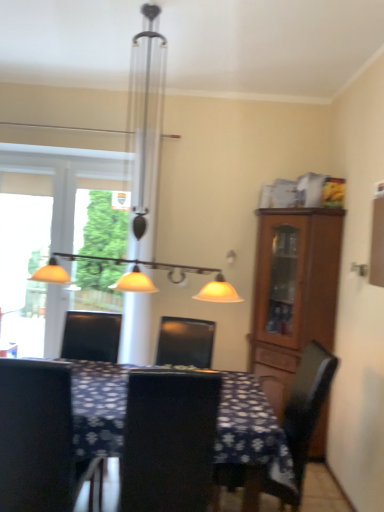
What is the approximate width of dark brown wooden chair at right, positioned as the first chair in right-to-left order?

The width of dark brown wooden chair at right, positioned as the first chair in right-to-left order, is 25.05 inches.

Identify the location of matte metal chandelier at upper center. click(145, 174).

Identify the location of dark brown wooden chair at right, the 3th chair when ordered from left to right. This screenshot has height=512, width=384. (303, 416).

From the image's perspective, does matte metal chandelier at upper center appear lower than transparent glass window at left?

Actually, matte metal chandelier at upper center appears above transparent glass window at left in the image.

How much distance is there between matte metal chandelier at upper center and transparent glass window at left?

They are 35.66 inches apart.

From a real-world perspective, which is physically above, matte metal chandelier at upper center or transparent glass window at left?

matte metal chandelier at upper center is physically above.

Looking at the image, does matte metal chandelier at upper center seem bigger or smaller compared to transparent glass window at left?

Clearly, matte metal chandelier at upper center is larger in size than transparent glass window at left.

From the image's perspective, does matte metal chandelier at upper center appear lower than dark blue fabric table at center?

Actually, matte metal chandelier at upper center appears above dark blue fabric table at center in the image.

Is matte metal chandelier at upper center oriented away from dark blue fabric table at center?

No, matte metal chandelier at upper center's orientation is not away from dark blue fabric table at center.

Does matte metal chandelier at upper center come behind dark blue fabric table at center?

That is True.

Can you confirm if matte metal chandelier at upper center is taller than dark blue fabric table at center?

Yes, matte metal chandelier at upper center is taller than dark blue fabric table at center.

From the image's perspective, is transparent glass window at left beneath dark brown wooden chair at right, the 3th chair when ordered from left to right?

No, from the image's perspective, transparent glass window at left is not below dark brown wooden chair at right, the 3th chair when ordered from left to right.

Can you confirm if transparent glass window at left is smaller than dark brown wooden chair at right, the 3th chair when ordered from left to right?

Yes, transparent glass window at left is smaller than dark brown wooden chair at right, the 3th chair when ordered from left to right.

Which is further, (97, 162) or (322, 350)?

The point (97, 162) is farther from the camera.

Where is `window that appears above the dark brown wooden chair at right, the 3th chair when ordered from left to right (from the image's perspective)`? window that appears above the dark brown wooden chair at right, the 3th chair when ordered from left to right (from the image's perspective) is located at coordinates [x=57, y=238].

In terms of size, does black leather chair at center, the second chair viewed from the left, appear bigger or smaller than dark blue fabric table at center?

In the image, black leather chair at center, the second chair viewed from the left, appears to be smaller than dark blue fabric table at center.

From the image's perspective, who appears lower, black leather chair at center, the second chair viewed from the left, or dark blue fabric table at center?

dark blue fabric table at center.

Are black leather chair at center, which appears as the 2th chair when viewed from the right, and dark blue fabric table at center far apart?

No, black leather chair at center, which appears as the 2th chair when viewed from the right, is not far from dark blue fabric table at center.

Is point (195, 420) farther from viewer compared to point (80, 387)?

No, (195, 420) is closer to viewer.

Is dark brown wooden chair at right, positioned as the first chair in right-to-left order, inside or outside of dark blue fabric table at center?

dark brown wooden chair at right, positioned as the first chair in right-to-left order, is located inside dark blue fabric table at center.

Between point (310, 393) and point (259, 452), which one is positioned behind?

The point (310, 393) is more distant.

Are dark brown wooden chair at right, the 3th chair when ordered from left to right, and dark blue fabric table at center beside each other?

dark brown wooden chair at right, the 3th chair when ordered from left to right, is not next to dark blue fabric table at center, and they're not touching.

Is dark brown wooden chair at right, the 3th chair when ordered from left to right, turned away from dark blue fabric table at center?

Yes.

Are brown wooden cabinet at right and transparent glass window at left making contact?

No, brown wooden cabinet at right is not making contact with transparent glass window at left.

In terms of width, does brown wooden cabinet at right look wider or thinner when compared to transparent glass window at left?

Clearly, brown wooden cabinet at right has more width compared to transparent glass window at left.

Which is more to the left, brown wooden cabinet at right or transparent glass window at left?

Positioned to the left is transparent glass window at left.

Identify the location of cabinetry below the transparent glass window at left (from the image's perspective). The image size is (384, 512). (293, 289).

From the picture: Is dark blue fabric table at center taller than black matte chair at left, which is the 3th chair in right-to-left order?

No, dark blue fabric table at center is not taller than black matte chair at left, which is the 3th chair in right-to-left order.

From the image's perspective, does dark blue fabric table at center appear higher than black matte chair at left, marked as the 1th chair in a left-to-right arrangement?

Incorrect, from the image's perspective, dark blue fabric table at center is lower than black matte chair at left, marked as the 1th chair in a left-to-right arrangement.

Identify the location of table lying below the black matte chair at left, which is the 3th chair in right-to-left order (from the image's perspective). The width and height of the screenshot is (384, 512). (251, 430).

Where is `table lamp that appears on the right of transparent glass window at left`? This screenshot has height=512, width=384. table lamp that appears on the right of transparent glass window at left is located at coordinates (145, 174).

Where is `table below the matte metal chandelier at upper center (from a real-world perspective)`? table below the matte metal chandelier at upper center (from a real-world perspective) is located at coordinates (251, 430).

When comparing their distances from black leather chair at center, the second chair viewed from the left, does transparent glass window at left or matte metal chandelier at upper center seem further?

transparent glass window at left is positioned further to the anchor black leather chair at center, the second chair viewed from the left.

Looking at this image, which object lies nearer to the anchor point black leather chair at center, which appears as the 2th chair when viewed from the right, transparent glass window at left or brown wooden cabinet at right?

brown wooden cabinet at right is closer to black leather chair at center, which appears as the 2th chair when viewed from the right.

When comparing their distances from matte metal chandelier at upper center, does dark blue fabric table at center or transparent glass window at left seem further?

dark blue fabric table at center is further to matte metal chandelier at upper center.

Based on their spatial positions, is black matte chair at left, which is the 3th chair in right-to-left order, or dark brown wooden chair at right, the 3th chair when ordered from left to right, further from brown wooden cabinet at right?

Among the two, black matte chair at left, which is the 3th chair in right-to-left order, is located further to brown wooden cabinet at right.

Looking at this image, considering their positions, is transparent glass window at left positioned further to brown wooden cabinet at right than black leather chair at center, the second chair viewed from the left?

Among the two, transparent glass window at left is located further to brown wooden cabinet at right.

Looking at this image, which object lies further to the anchor point black matte chair at left, marked as the 1th chair in a left-to-right arrangement, matte metal chandelier at upper center or brown wooden cabinet at right?

Among the two, brown wooden cabinet at right is located further to black matte chair at left, marked as the 1th chair in a left-to-right arrangement.

Considering their positions, is transparent glass window at left positioned closer to black leather chair at center, which appears as the 2th chair when viewed from the right, than black matte chair at left, which is the 3th chair in right-to-left order?

black matte chair at left, which is the 3th chair in right-to-left order, is positioned closer to the anchor black leather chair at center, which appears as the 2th chair when viewed from the right.

Which object lies nearer to the anchor point black matte chair at left, marked as the 1th chair in a left-to-right arrangement, brown wooden cabinet at right or dark brown wooden chair at right, positioned as the first chair in right-to-left order?

The object closer to black matte chair at left, marked as the 1th chair in a left-to-right arrangement, is dark brown wooden chair at right, positioned as the first chair in right-to-left order.

I want to click on chair between black matte chair at left, marked as the 1th chair in a left-to-right arrangement, and dark brown wooden chair at right, positioned as the first chair in right-to-left order, so click(168, 440).

Where is `chair between matte metal chandelier at upper center and black leather chair at center, the second chair viewed from the left, in the up-down direction`? The height and width of the screenshot is (512, 384). chair between matte metal chandelier at upper center and black leather chair at center, the second chair viewed from the left, in the up-down direction is located at coordinates (38, 438).

Find the location of `table between black matte chair at left, marked as the 1th chair in a left-to-right arrangement, and brown wooden cabinet at right, in the horizontal direction`. table between black matte chair at left, marked as the 1th chair in a left-to-right arrangement, and brown wooden cabinet at right, in the horizontal direction is located at coordinates (251, 430).

At what (x,y) coordinates should I click in order to perform the action: click on chair between dark blue fabric table at center and dark brown wooden chair at right, the 3th chair when ordered from left to right. Please return your answer as a coordinate pair (x, y). This screenshot has width=384, height=512. Looking at the image, I should click on (168, 440).